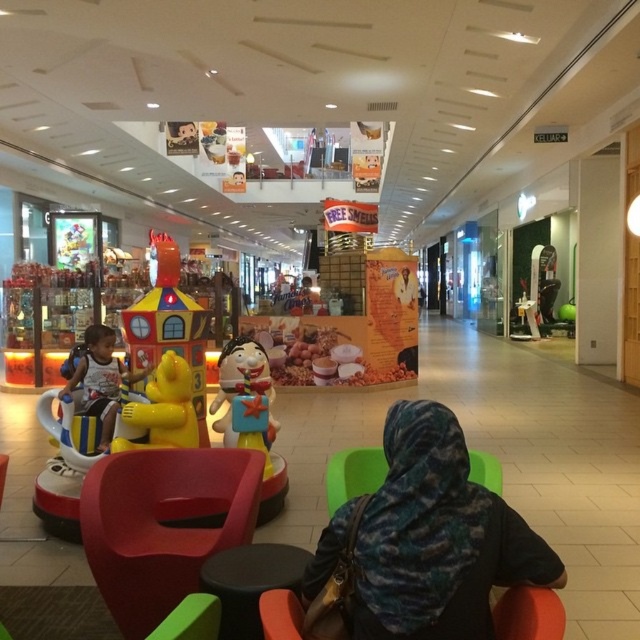
You are a parent looking for a comfortable place to sit while watching your child play. You see the orange fabric armchair at lower center and the yellow matte bear at center. Which one is smaller and more suitable for sitting?

The orange fabric armchair at lower center is smaller than the yellow matte bear at center, making it more suitable for sitting.

You are a customer in the shopping mall and want to reach the matte black helmet at left. However, there is a yellow matte bear at center blocking your path. Can you walk around the bear to get to the helmet?

The yellow matte bear at center is in front of the matte black helmet at left, so you can walk around the bear to reach the helmet since it is blocking the direct path.